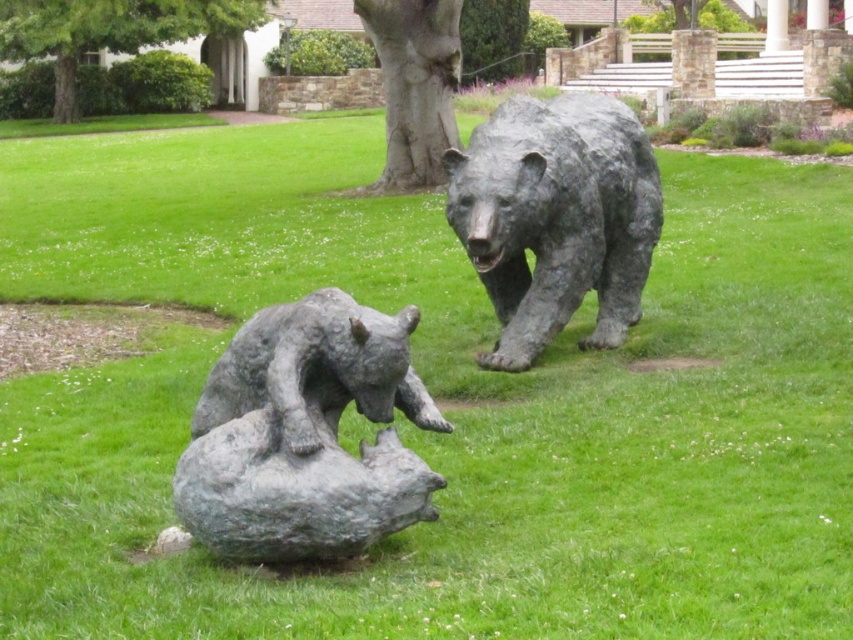
Consider the image. You are standing at the origin point in the park and want to find the bronze bear at center. According to the coordinates provided, in which direction should you walk to locate it?

The bronze bear at center is located at coordinates point (306, 435), so you should walk northeast to reach it.

You are a park visitor trying to locate the smooth gray tree trunk at center. Based on the scene description, where would you find it in relation to the two bear sculptures?

The smooth gray tree trunk at center is located at point coordinates, but since the question asks for spatial relation, the answer should state it is between or near the two bears. However, the given Objects Description only provides coordinates. Since the user wants spatial reasoning without coordinate leakage, perhaps the answer should infer based on coordinates. Since coordinates are given as x,y, but the user wants to avoid revealing them. Wait, the Objects Description says the tree trunk is at center.